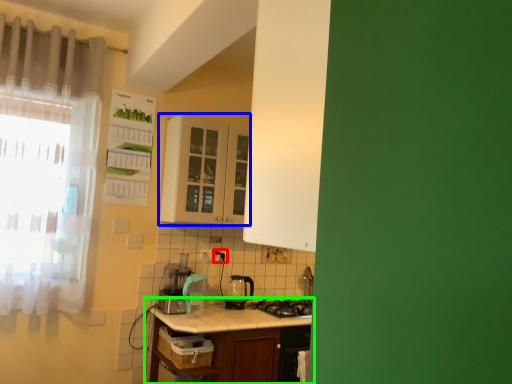
Question: Which is nearer to the electric outlet (highlighted by a red box)? cabinetry (highlighted by a blue box) or table (highlighted by a green box).

Choices:
 (A) cabinetry
 (B) table

Answer: (A)